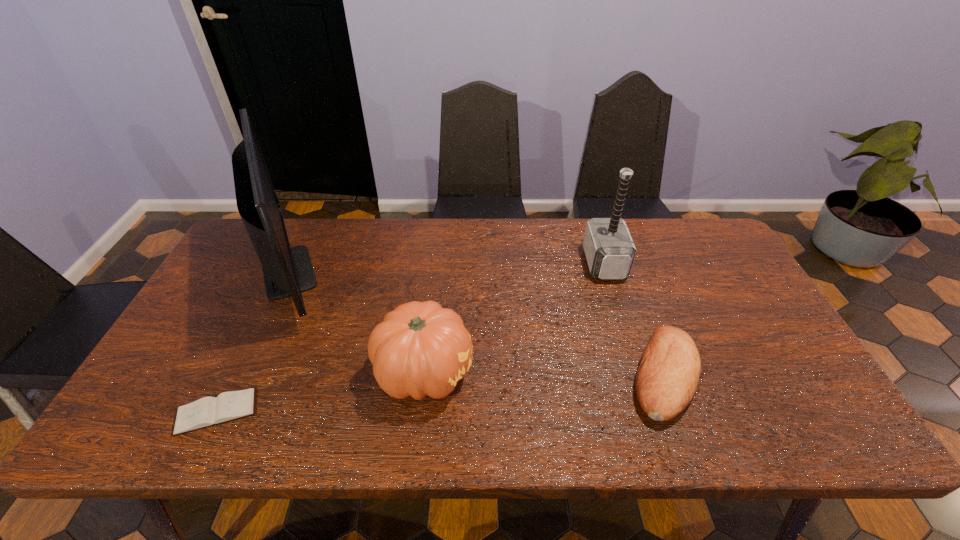
Image resolution: width=960 pixels, height=540 pixels. Find the location of `empty space that is in between the computer monitor and the third shortest object`. empty space that is in between the computer monitor and the third shortest object is located at coordinates (359, 321).

I want to click on vacant region between the diary and the computer monitor, so coord(255,341).

At what (x,y) coordinates should I click in order to perform the action: click on empty location between the bread and the pumpkin. Please return your answer as a coordinate pair (x, y). The height and width of the screenshot is (540, 960). Looking at the image, I should click on (544, 374).

Locate an element on the screen. The height and width of the screenshot is (540, 960). free spot between the third tallest object and the fourth shortest object is located at coordinates (515, 318).

Identify the location of blank region between the fourth shortest object and the pumpkin. (515, 318).

Locate an element on the screen. This screenshot has width=960, height=540. blank region between the hammer and the bread is located at coordinates click(x=635, y=320).

Select which object appears as the second closest to the computer monitor. Please provide its 2D coordinates. Your answer should be formatted as a tuple, i.e. [(x, y)], where the tuple contains the x and y coordinates of a point satisfying the conditions above.

[(420, 348)]

Locate an element on the screen. Image resolution: width=960 pixels, height=540 pixels. object that is the second nearest to the computer monitor is located at coordinates (420, 348).

Where is `free point that satisfies the following two spatial constraints: 1. for striking with the head of the hammer; 2. on the back side of the fourth tallest object`? This screenshot has height=540, width=960. free point that satisfies the following two spatial constraints: 1. for striking with the head of the hammer; 2. on the back side of the fourth tallest object is located at coordinates (639, 376).